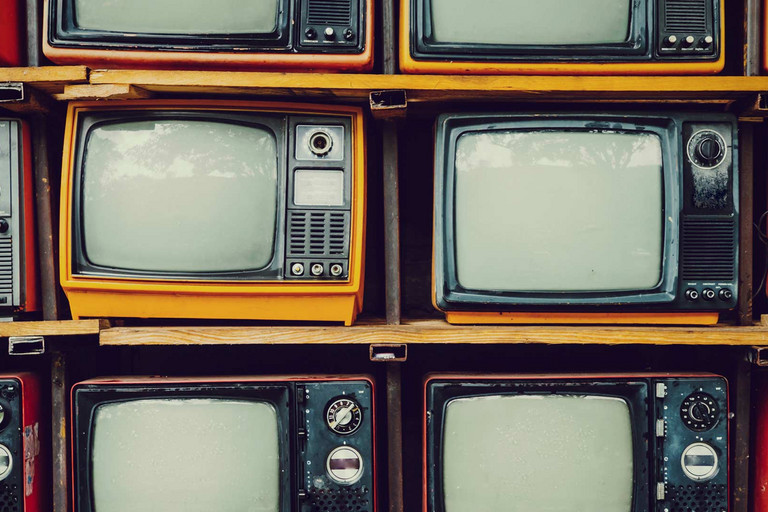
Locate an element on the screen. The height and width of the screenshot is (512, 768). screens is located at coordinates (171, 478), (553, 432), (531, 267), (233, 252), (194, 11), (520, 15).